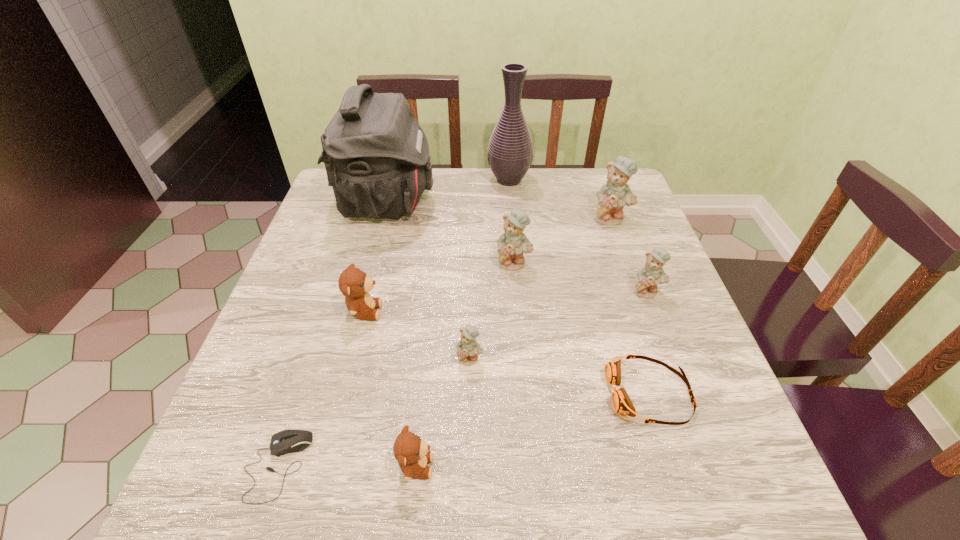
The image size is (960, 540). In order to click on vacant space that satisfies the following two spatial constraints: 1. on the front-facing side of the second farthest teddy bear; 2. on the face of the nearer brown teddy bear in this screenshot , I will do `click(530, 466)`.